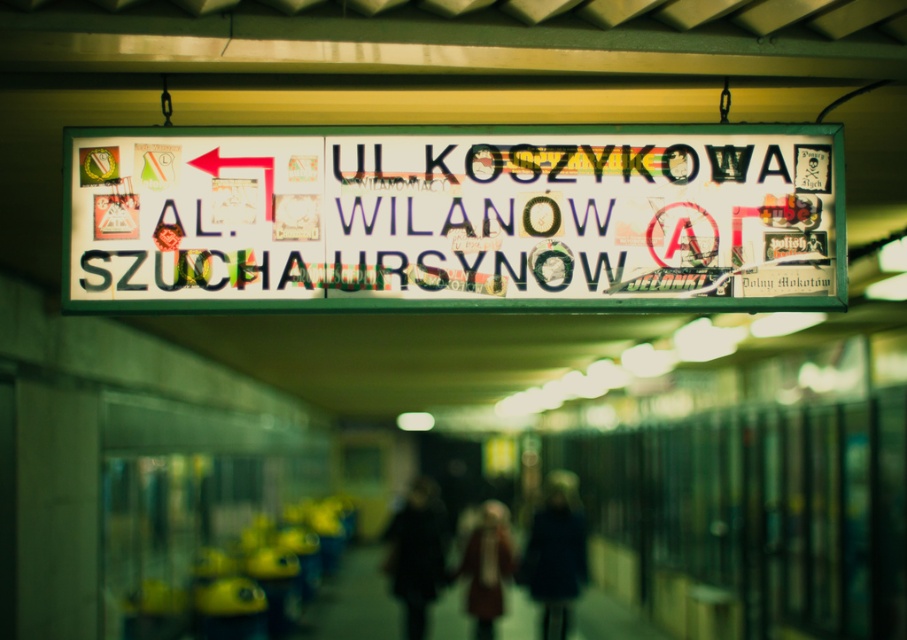
Question: Estimate the real-world distances between objects in this image. Which object is farther from the dark brown leather coat at center?

Choices:
 (A) red wool coat at center
 (B) white paper sign at center
 (C) dark blue coat at center

Answer: (B)

Question: Does dark brown leather coat at center have a smaller size compared to red wool coat at center?

Choices:
 (A) yes
 (B) no

Answer: (A)

Question: Is white paper sign at center behind dark blue coat at center?

Choices:
 (A) no
 (B) yes

Answer: (A)

Question: Among these points, which one is nearest to the camera?

Choices:
 (A) (554, 593)
 (B) (588, 240)
 (C) (421, 618)
 (D) (485, 554)

Answer: (B)

Question: Which object is farther from the camera taking this photo?

Choices:
 (A) white paper sign at center
 (B) dark blue coat at center

Answer: (B)

Question: Does dark brown leather coat at center have a smaller size compared to red wool coat at center?

Choices:
 (A) yes
 (B) no

Answer: (A)